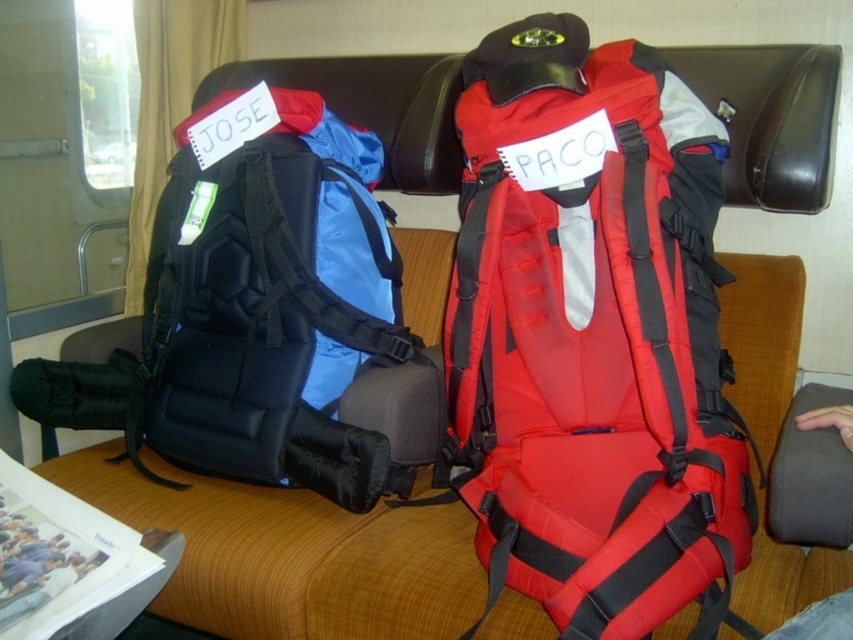
You are a passenger on a train and see the matte red backpack at center and the matte black backpack at left. Which backpack is closer to you?

The matte red backpack at center is closer to you because it is in front of the matte black backpack at left.

You are a passenger on a train and need to retrieve your matte red backpack at center and your matte black backpack at left. Which backpack should you move first to access the one underneath?

The matte red backpack at center should be moved first because it is below the matte black backpack at left, meaning the matte black backpack is on top and blocking access to the red one.

You are standing at the point marked by the coordinates point [451,458] and want to reach the nearest exit door, which is 2 meters away from your current position. Can you safely walk straight to the exit without encountering any obstacles?

The distance between point [451,458] and the viewer is 1.36 meters, but the exit door is 2 meters away. Since the exit is further away than the distance to the viewer, you might need to navigate around any potential obstacles between you and the exit. However, the provided information does not mention any obstacles beyond the backpacks and the newspaper. Assuming the path is clear, you could proceed cautiously towards the exit.